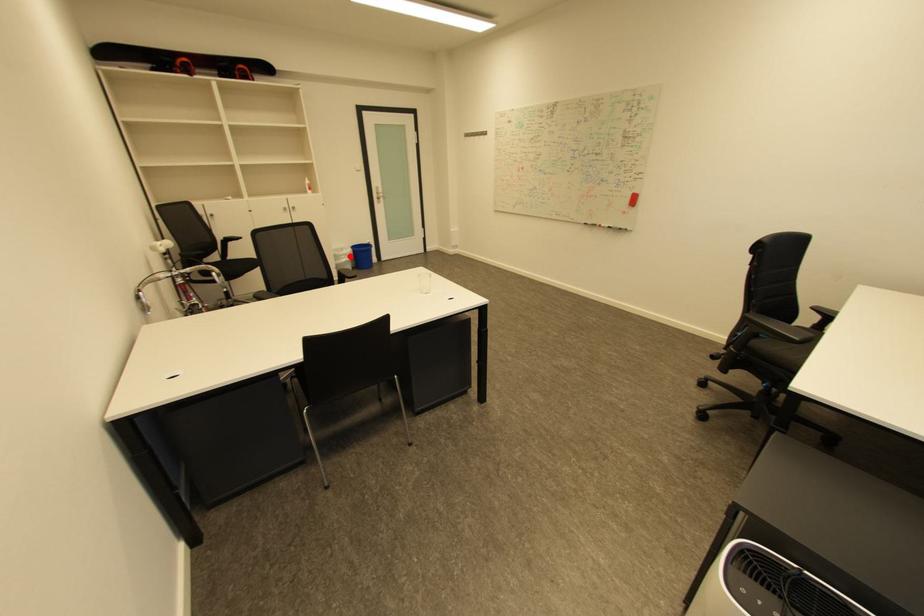
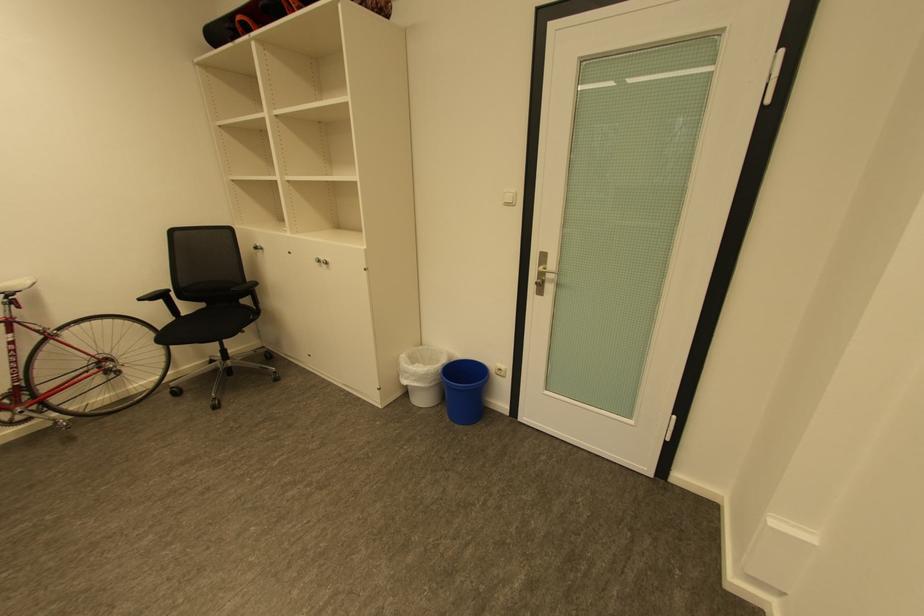
Question: I am providing you with two images of the same scene from different viewpoints. In image1, a red point is highlighted. Considering the same 3D point in image2, which of the following is correct?

Choices:
 (A) It is closer
 (B) It is farther

Answer: (B)